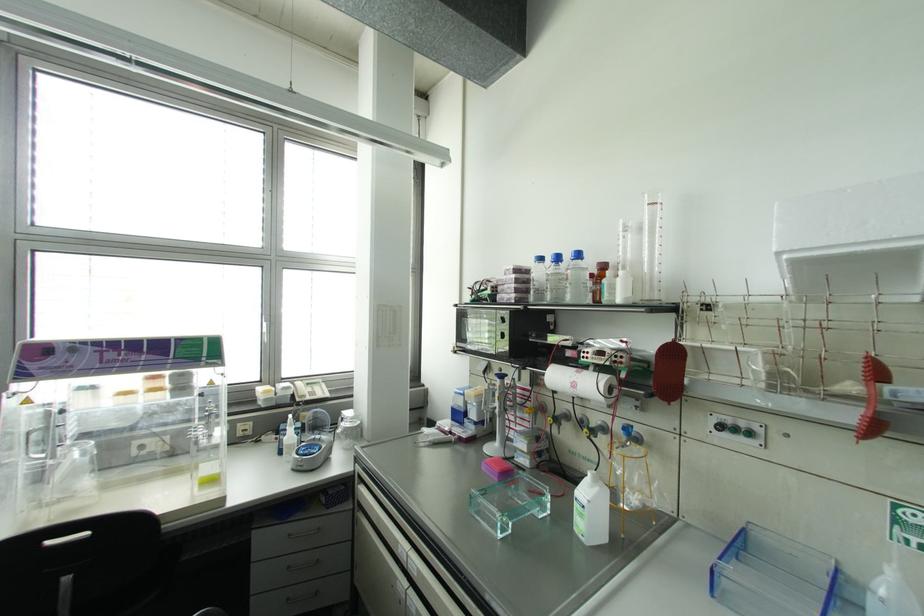
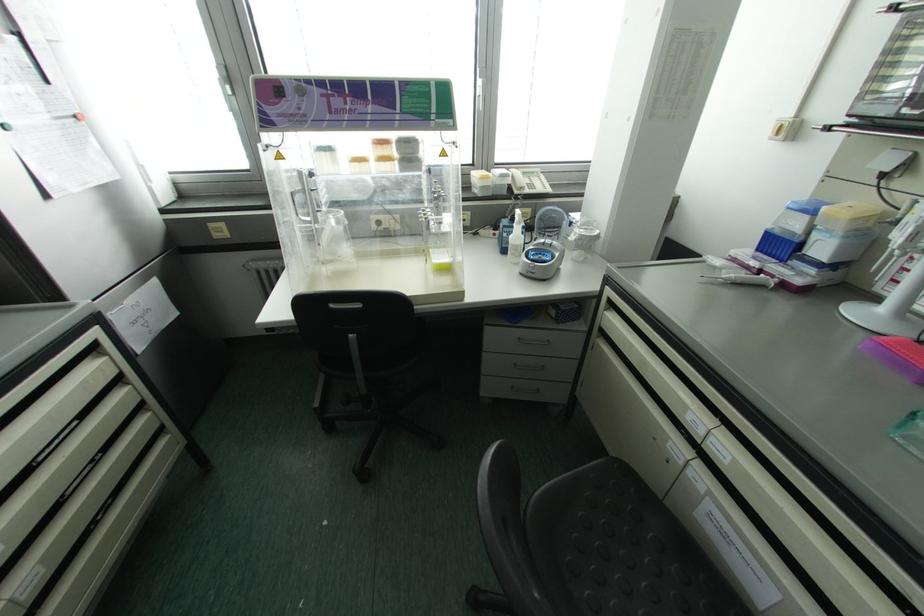
In the second image, find the point that corresponds to [164,397] in the first image.

(393, 169)